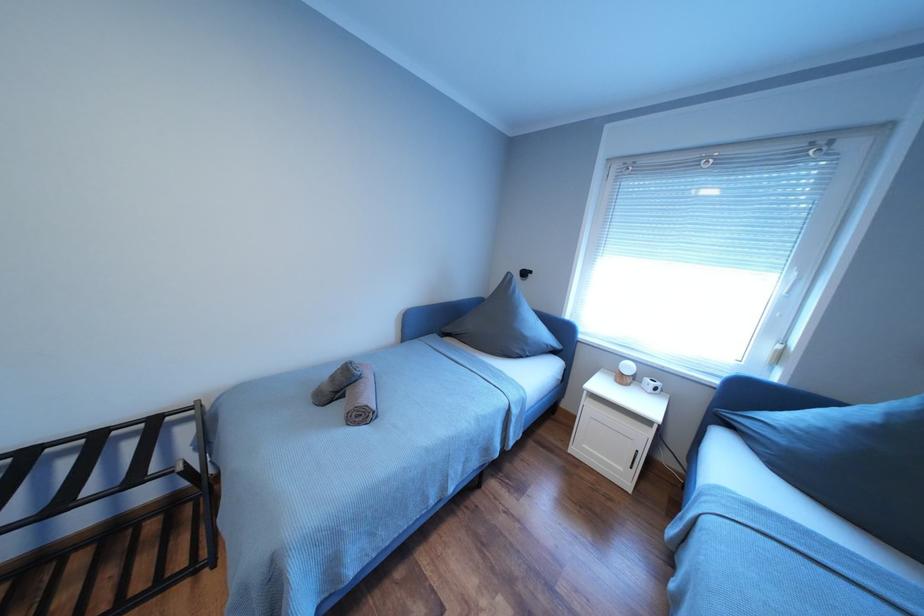
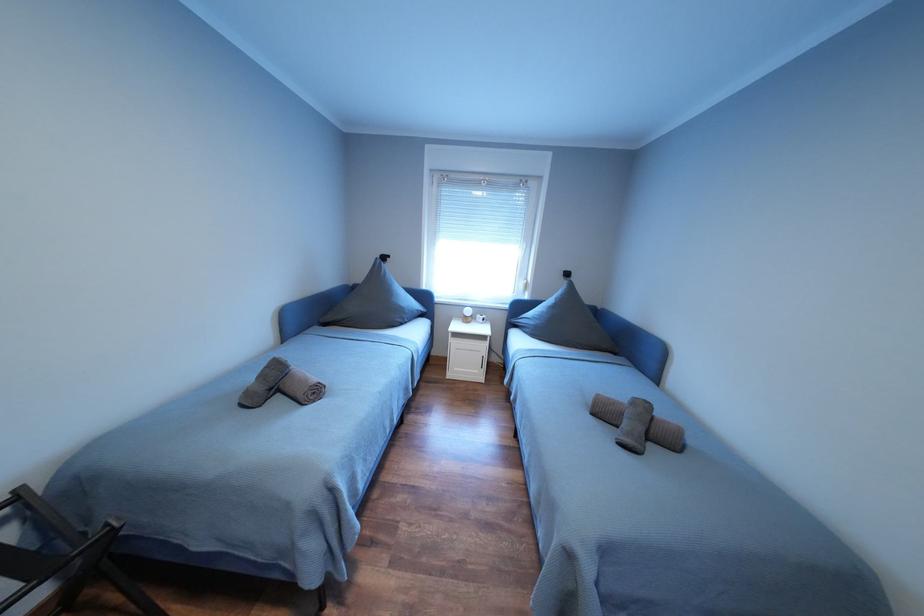
Question: The camera is either moving clockwise (left) or counter-clockwise (right) around the object. The first image is from the beginning of the video and the second image is from the end. Is the camera moving left or right when shooting the video?

Choices:
 (A) Left
 (B) Right

Answer: (A)